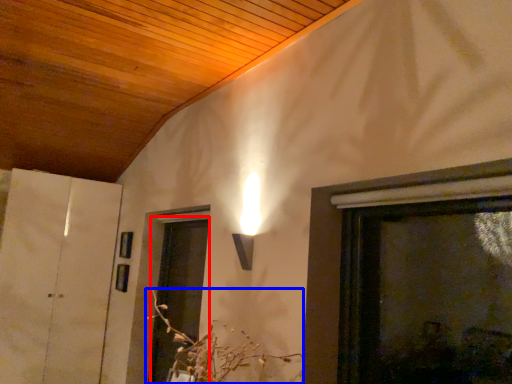
Question: Among these objects, which one is nearest to the camera, screen door (highlighted by a red box) or flower (highlighted by a blue box)?

Choices:
 (A) screen door
 (B) flower

Answer: (B)